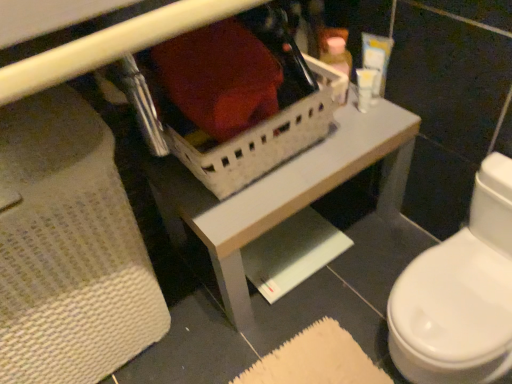
This screenshot has width=512, height=384. Find the location of `free space in front of white plastic container at upper right, the 2th toiletry when ordered from right to left`. free space in front of white plastic container at upper right, the 2th toiletry when ordered from right to left is located at coordinates (358, 141).